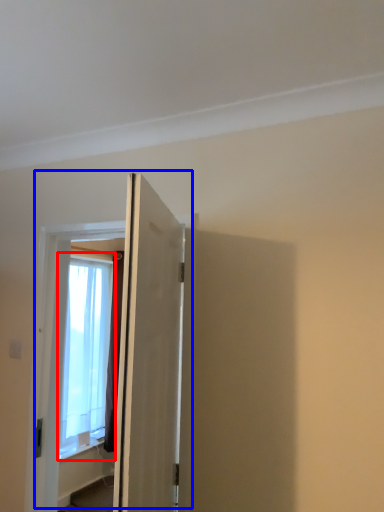
Question: Among these objects, which one is farthest to the camera, window (highlighted by a red box) or door (highlighted by a blue box)?

Choices:
 (A) window
 (B) door

Answer: (A)